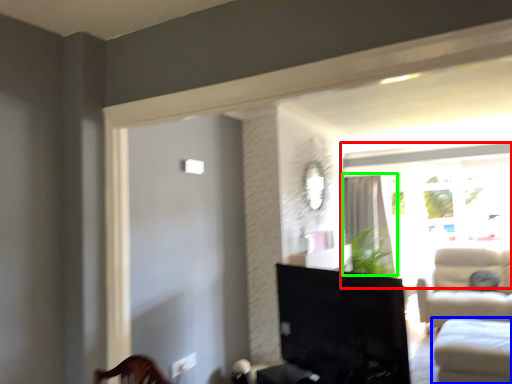
Question: Estimate the real-world distances between objects in this image. Which object is farther from window (highlighted by a red box), studio couch (highlighted by a blue box) or curtain (highlighted by a green box)?

Choices:
 (A) studio couch
 (B) curtain

Answer: (A)